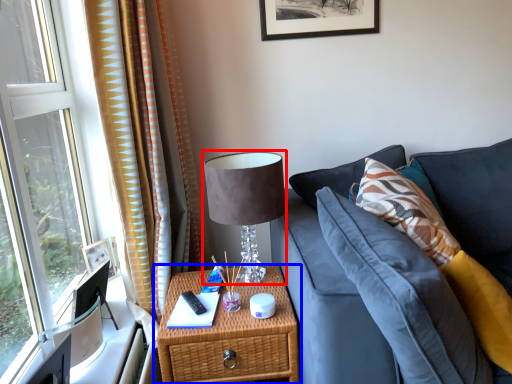
Question: Among these objects, which one is nearest to the camera, table lamp (highlighted by a red box) or nightstand (highlighted by a blue box)?

Choices:
 (A) table lamp
 (B) nightstand

Answer: (B)